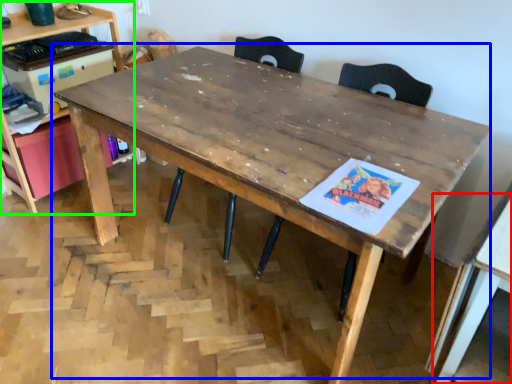
Question: Which object is the farthest from table (highlighted by a red box)? Choose among these: table (highlighted by a blue box) or computer desk (highlighted by a green box).

Choices:
 (A) table
 (B) computer desk

Answer: (B)